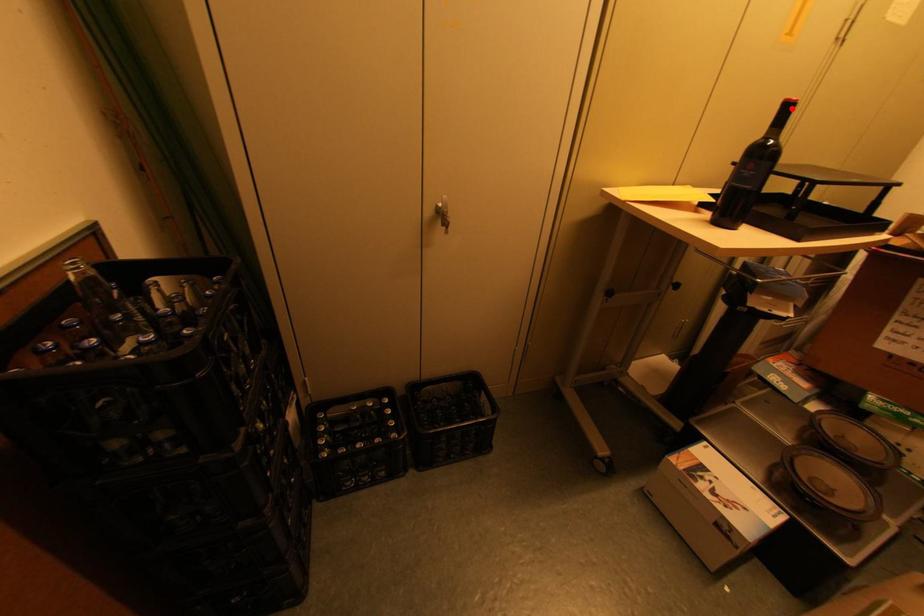
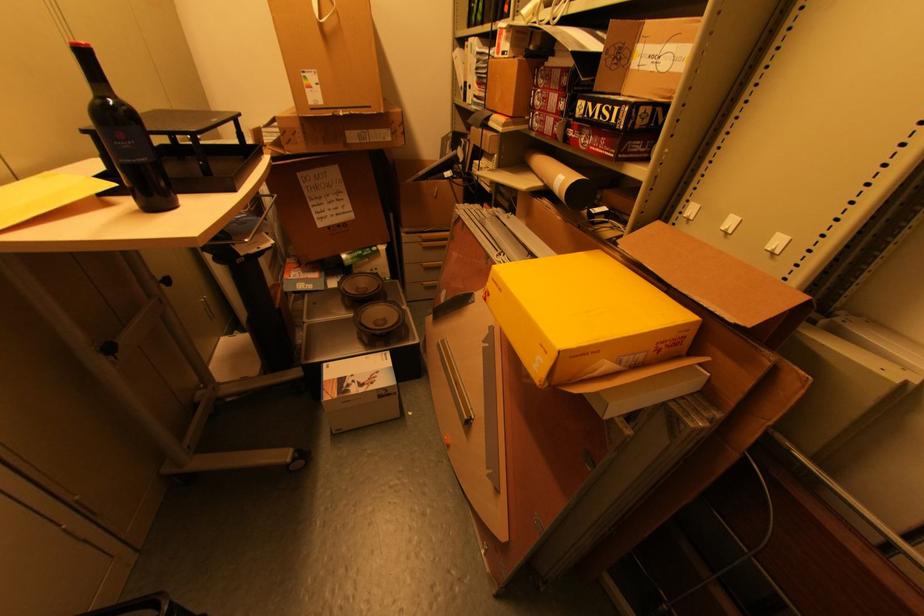
Locate, in the second image, the point that corresponds to the highlighted location in the first image.

(89, 55)